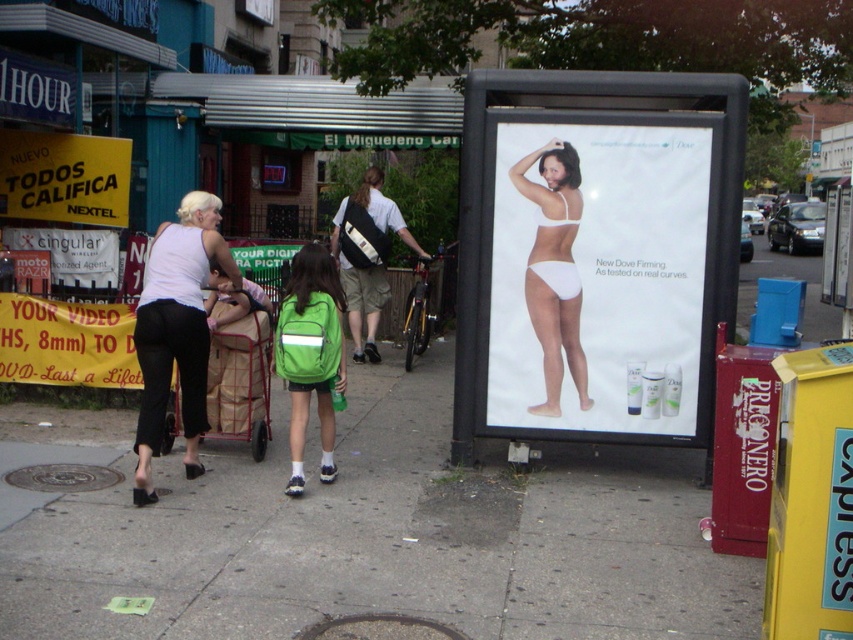
Question: Is white cotton tank top at left bigger than white fabric underwear at center?

Choices:
 (A) yes
 (B) no

Answer: (A)

Question: Based on their relative distances, which object is nearer to the yellow paper at upper left?

Choices:
 (A) green backpack at center
 (B) white fabric bikini at center
 (C) white matte bikini top at center

Answer: (A)

Question: Considering the real-world distances, which object is closest to the white fabric underwear at center?

Choices:
 (A) green fabric backpack at center
 (B) green backpack at center
 (C) white matte bikini top at center
 (D) concrete at center

Answer: (C)

Question: Which point is farther to the camera?

Choices:
 (A) yellow paper at upper left
 (B) white fabric bikini at center
 (C) white plastic poster at center
 (D) white fabric underwear at center

Answer: (A)

Question: Is white fabric underwear at center smaller than white matte bikini top at center?

Choices:
 (A) no
 (B) yes

Answer: (A)

Question: Observing the image, what is the correct spatial positioning of white fabric bikini at center in reference to yellow paper at upper left?

Choices:
 (A) right
 (B) left

Answer: (A)